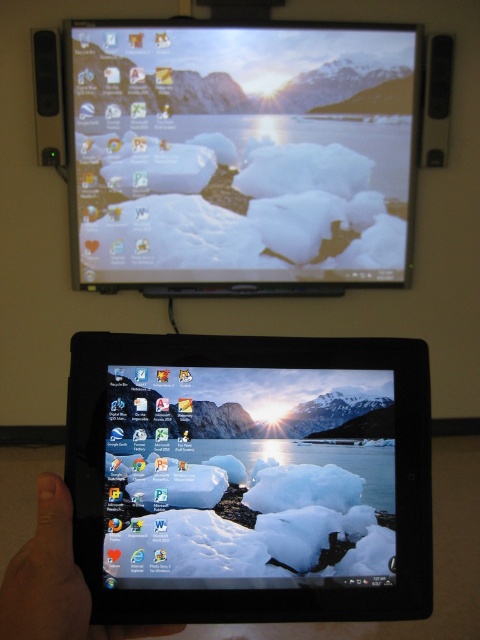
Question: In this image, where is black plastic tablet at center located relative to matte plastic desktop at upper center?

Choices:
 (A) above
 (B) below

Answer: (B)

Question: Can you confirm if black plastic tablet at center is bigger than skinny finger at lower left?

Choices:
 (A) no
 (B) yes

Answer: (B)

Question: Which point appears closest to the camera in this image?

Choices:
 (A) (80, 637)
 (B) (206, 474)
 (C) (303, 36)

Answer: (A)

Question: Considering the real-world distances, which object is closest to the skinny finger at lower left?

Choices:
 (A) matte plastic desktop at upper center
 (B) black plastic tablet at center

Answer: (B)

Question: Is black plastic tablet at center wider than skinny finger at lower left?

Choices:
 (A) yes
 (B) no

Answer: (A)

Question: Among these objects, which one is nearest to the camera?

Choices:
 (A) skinny finger at lower left
 (B) matte plastic desktop at upper center

Answer: (A)